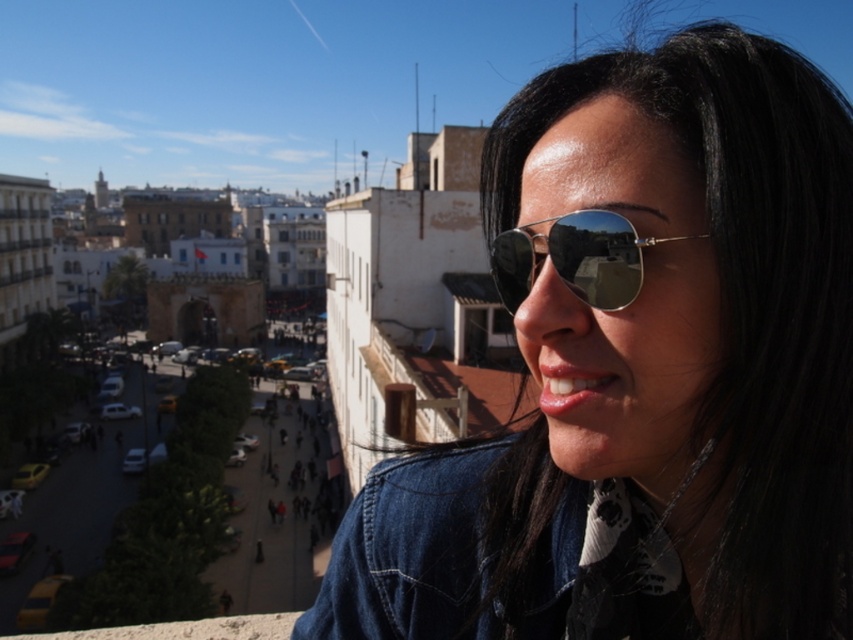
You are standing on a balcony overlooking the city. You notice two points in the scene, one at coordinates point (601, 248) and another at point (421, 468). Which point is closer to you?

Point (601, 248) is in front of point (421, 468), so it is closer to you.

You are a fashion designer observing the urban scene. You notice the denim jacket at lower right and the silver reflective sunglasses at center. Which item appears larger in the image?

The denim jacket at lower right is taller than the silver reflective sunglasses at center, so it appears larger in the image.

You are standing on a balcony overlooking the city and want to take a photo of two points in the scene. The first point is at coordinates point (416, 540) and the second is at point (550, 227). Which point is closer to you?

Point (416, 540) is further to the viewer than point (550, 227). Therefore, point (550, 227) is closer to you.